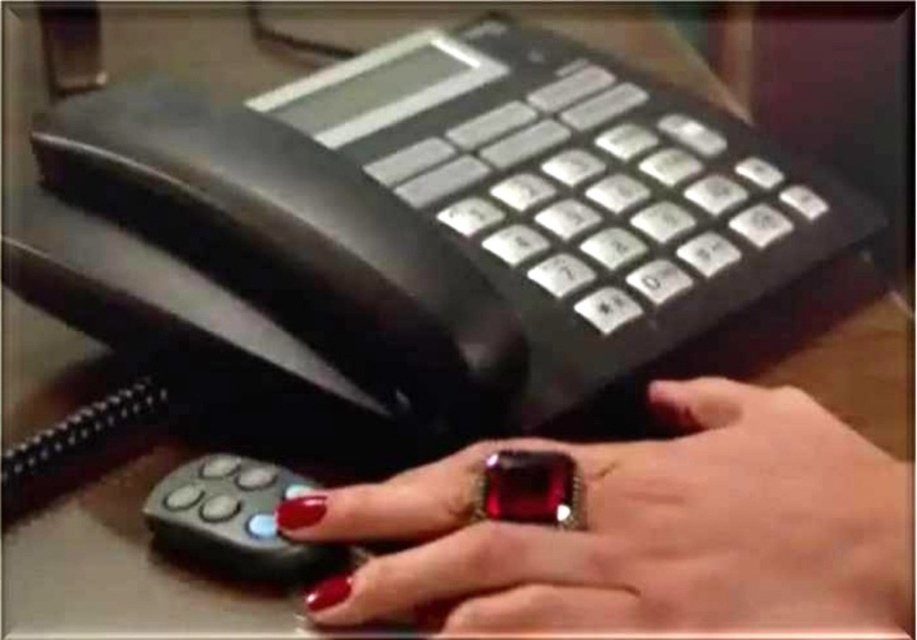
From the picture: Measure the distance from shiny red nail polish at center to black rubber remote at lower left.

The distance of shiny red nail polish at center from black rubber remote at lower left is 3.79 inches.

Is shiny red nail polish at center smaller than black rubber remote at lower left?

Actually, shiny red nail polish at center might be larger than black rubber remote at lower left.

Who is more forward, [525,541] or [268,477]?

Point [525,541] is more forward.

The height and width of the screenshot is (640, 917). I want to click on shiny red nail polish at center, so click(643, 529).